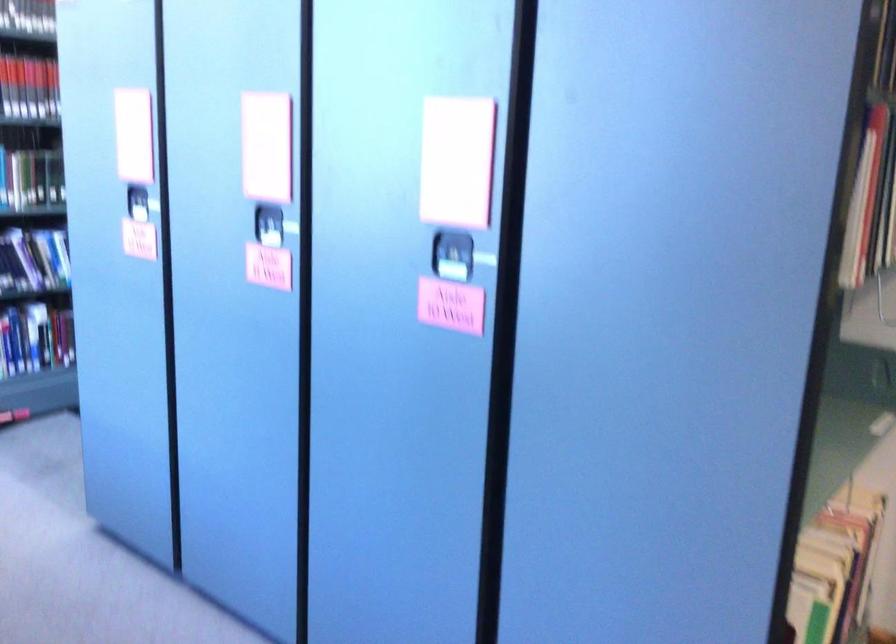
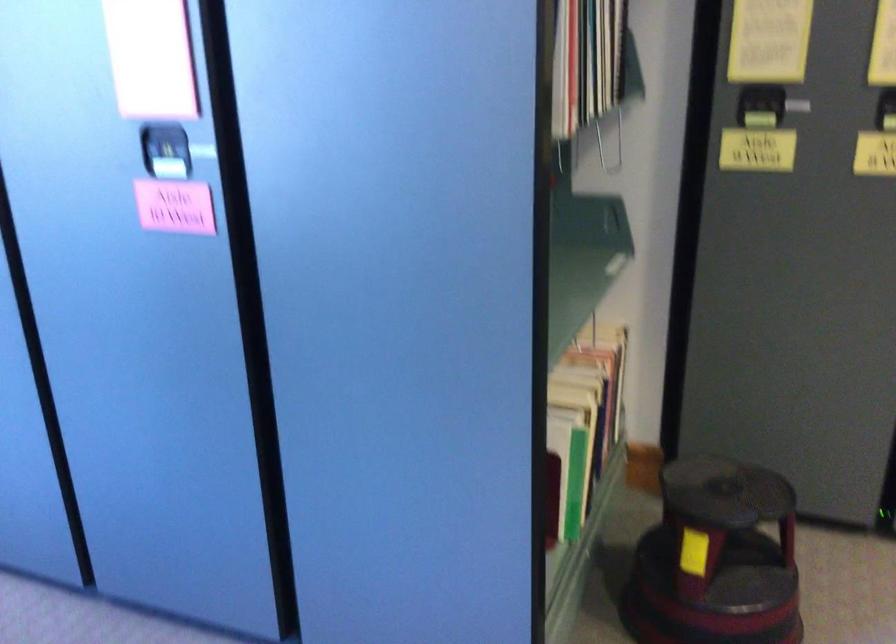
Locate, in the second image, the point that corresponds to point 454,254 in the first image.

(165, 151)